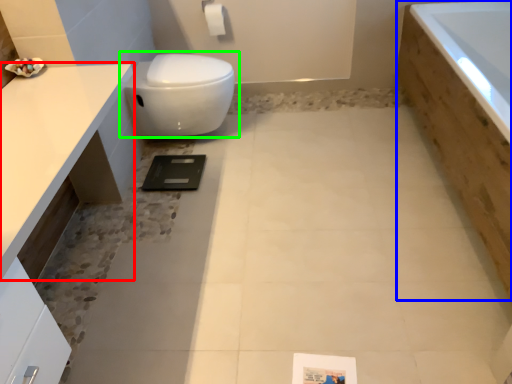
Question: Which object is positioned farthest from countertop (highlighted by a red box)? Select from bath (highlighted by a blue box) and toilet (highlighted by a green box).

Choices:
 (A) bath
 (B) toilet

Answer: (A)